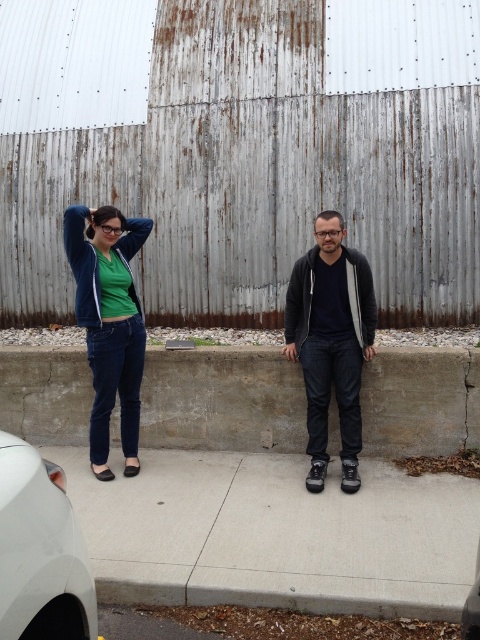
Who is positioned more to the left, gray concrete pavement at center or white matte car at lower left?

Positioned to the left is white matte car at lower left.

Can you confirm if gray concrete pavement at center is wider than white matte car at lower left?

Yes, gray concrete pavement at center is wider than white matte car at lower left.

The image size is (480, 640). Identify the location of gray concrete pavement at center. (276, 532).

How distant is gray concrete pavement at center from matte blue jeans at left?

gray concrete pavement at center and matte blue jeans at left are 1.28 meters apart.

Is point (383, 515) closer to viewer compared to point (313, 346)?

Yes.

You are a GUI agent. You are given a task and a screenshot of the screen. Output one action in this format:
    pyautogui.click(x=<x>, y=<y>)
    Task: Click on the gray concrete pavement at center
    The width and height of the screenshot is (480, 640).
    Given the screenshot: What is the action you would take?
    pyautogui.click(x=276, y=532)

Is white matte car at lower left in front of matte blue jacket at left?

Yes, it is.

Does white matte car at lower left appear under matte blue jacket at left?

Yes.

Which is in front, point (24, 602) or point (73, 228)?

Positioned in front is point (24, 602).

At what (x,y) coordinates should I click in order to perform the action: click on white matte car at lower left. Please return your answer as a coordinate pair (x, y). This screenshot has height=640, width=480. Looking at the image, I should click on (40, 552).